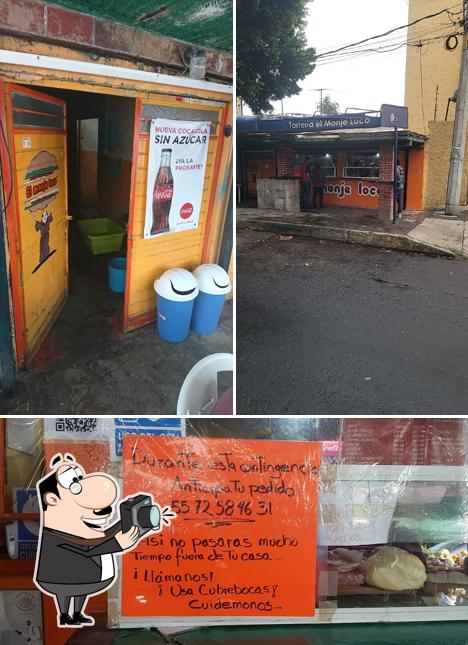
This screenshot has width=468, height=645. Identify the location of garbage cans. (179, 306), (203, 310).